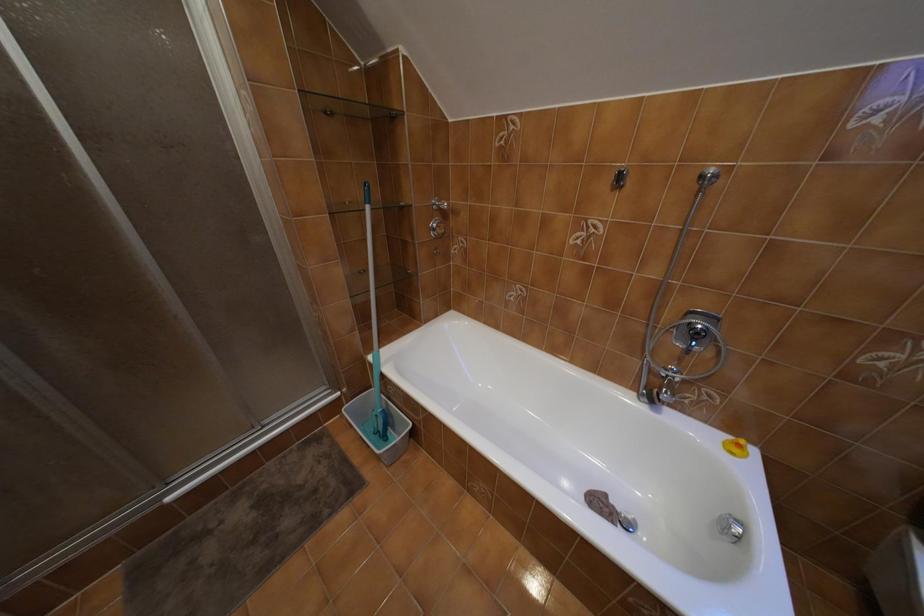
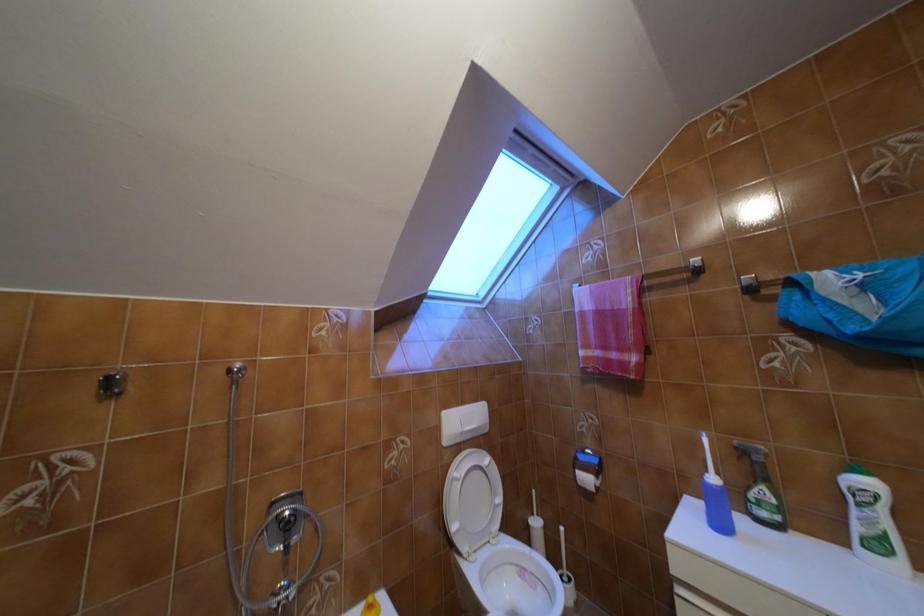
Question: The first image is from the beginning of the video and the second image is from the end. How did the camera likely rotate when shooting the video?

Choices:
 (A) Left
 (B) Right
 (C) Up
 (D) Down

Answer: (B)